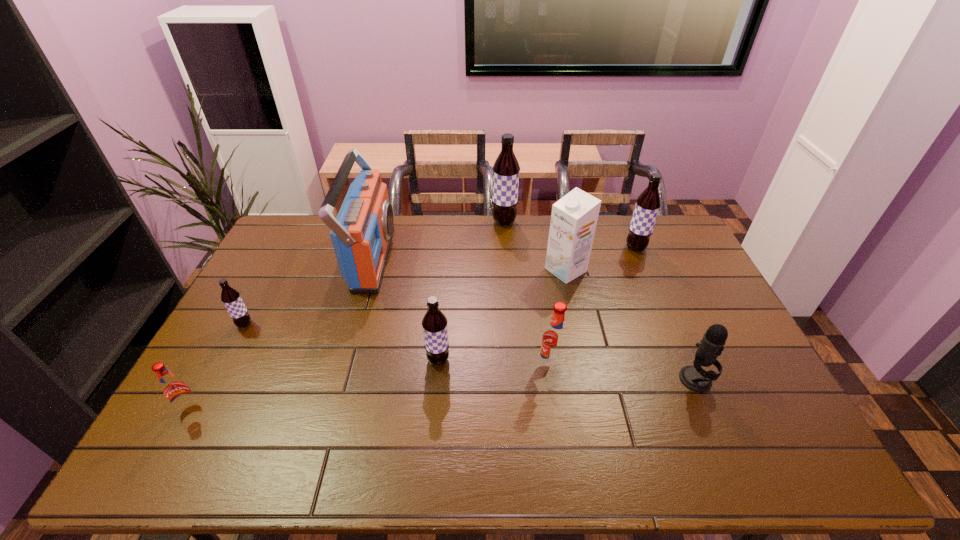
Where is `vacant space that satisfies the following two spatial constraints: 1. on the front-facing side of the carton; 2. on the left side of the third object from left to right`? vacant space that satisfies the following two spatial constraints: 1. on the front-facing side of the carton; 2. on the left side of the third object from left to right is located at coordinates (369, 270).